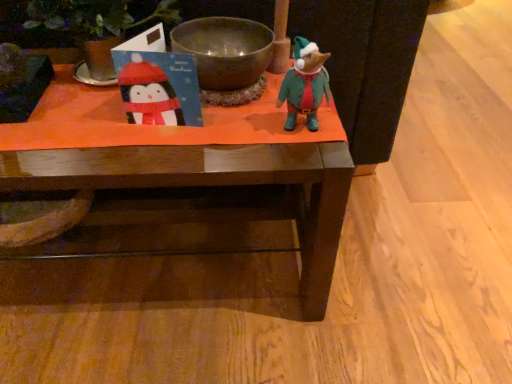
Identify the location of free space that is to the left of green felt mouse at center. (223, 142).